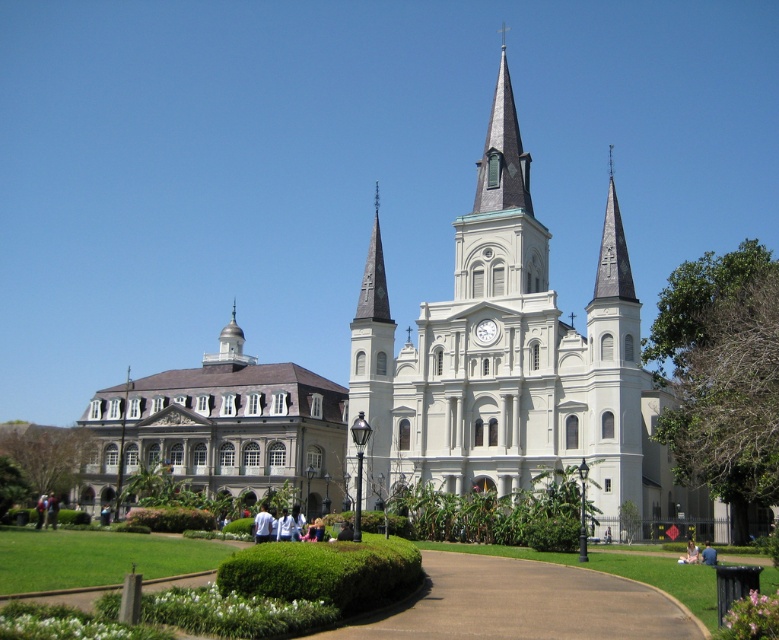
Between white stone church at center and blue denim jeans at lower center, which one appears on the left side from the viewer's perspective?

From the viewer's perspective, white stone church at center appears more on the left side.

Is white stone church at center thinner than blue denim jeans at lower center?

No.

Is point (231, 401) in front of point (705, 541)?

No, (231, 401) is behind (705, 541).

Locate an element on the screen. Image resolution: width=779 pixels, height=640 pixels. white stone church at center is located at coordinates (513, 364).

Can you confirm if white stone building at left is bigger than light brown hair at lower right?

Correct, white stone building at left is larger in size than light brown hair at lower right.

This screenshot has width=779, height=640. I want to click on white stone building at left, so click(x=224, y=428).

At what (x,y) coordinates should I click in order to perform the action: click on white stone building at left. Please return your answer as a coordinate pair (x, y). Looking at the image, I should click on (224, 428).

Which is behind, point (516, 333) or point (125, 451)?

Positioned behind is point (125, 451).

Does white stone church at center appear on the left side of white stone building at left?

Incorrect, white stone church at center is not on the left side of white stone building at left.

Is point (621, 376) positioned in front of point (323, 440)?

Yes, it is in front of point (323, 440).

You are a GUI agent. You are given a task and a screenshot of the screen. Output one action in this format:
    pyautogui.click(x=<x>, y=<y>)
    Task: Click on the white stone church at center
    The image size is (779, 640).
    Given the screenshot: What is the action you would take?
    pyautogui.click(x=513, y=364)